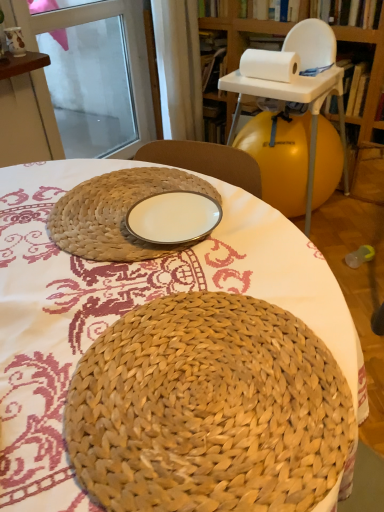
Question: Should I look upward or downward to see wooden bookshelf at upper right?

Choices:
 (A) up
 (B) down

Answer: (A)

Question: Is natural woven placemat at center taller than wooden bookshelf at upper right?

Choices:
 (A) no
 (B) yes

Answer: (A)

Question: Is natural woven placemat at center wider than wooden bookshelf at upper right?

Choices:
 (A) no
 (B) yes

Answer: (B)

Question: Is natural woven placemat at center at the left side of wooden bookshelf at upper right?

Choices:
 (A) yes
 (B) no

Answer: (A)

Question: Is natural woven placemat at center at the right side of wooden bookshelf at upper right?

Choices:
 (A) no
 (B) yes

Answer: (A)

Question: From the image's perspective, would you say natural woven placemat at center is shown under wooden bookshelf at upper right?

Choices:
 (A) no
 (B) yes

Answer: (B)

Question: Is natural woven placemat at center facing away from wooden bookshelf at upper right?

Choices:
 (A) yes
 (B) no

Answer: (B)

Question: From a real-world perspective, is wooden bookshelf at upper right on top of white fabric curtain at upper center?

Choices:
 (A) yes
 (B) no

Answer: (B)

Question: Is wooden bookshelf at upper right in front of white fabric curtain at upper center?

Choices:
 (A) yes
 (B) no

Answer: (A)

Question: From a real-world perspective, is wooden bookshelf at upper right positioned under white fabric curtain at upper center based on gravity?

Choices:
 (A) yes
 (B) no

Answer: (A)

Question: Is the position of wooden bookshelf at upper right more distant than that of white fabric curtain at upper center?

Choices:
 (A) yes
 (B) no

Answer: (B)

Question: From the image's perspective, is wooden bookshelf at upper right located beneath white fabric curtain at upper center?

Choices:
 (A) yes
 (B) no

Answer: (A)

Question: Considering the relative positions of wooden bookshelf at upper right and white fabric curtain at upper center in the image provided, is wooden bookshelf at upper right to the right of white fabric curtain at upper center from the viewer's perspective?

Choices:
 (A) no
 (B) yes

Answer: (B)

Question: Does white fabric curtain at upper center appear on the left side of wooden bookshelf at upper right?

Choices:
 (A) no
 (B) yes

Answer: (B)